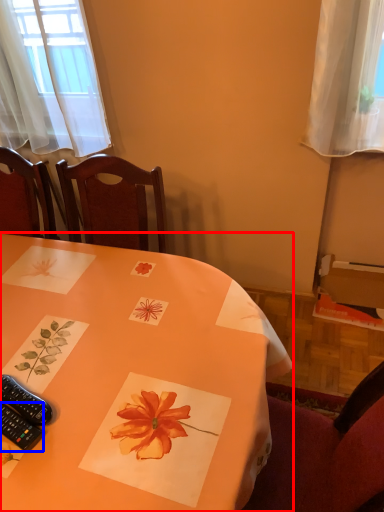
Question: Which of the following is the closest to the observer, table (highlighted by a red box) or remote control (highlighted by a blue box)?

Choices:
 (A) table
 (B) remote control

Answer: (A)